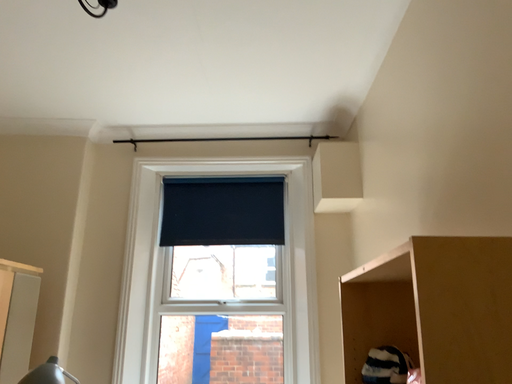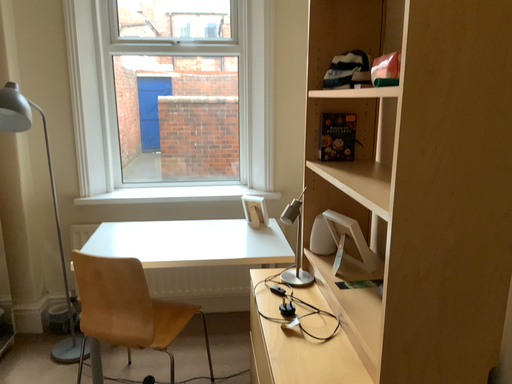
Question: Which way did the camera rotate in the video?

Choices:
 (A) rotated left
 (B) rotated right

Answer: (B)